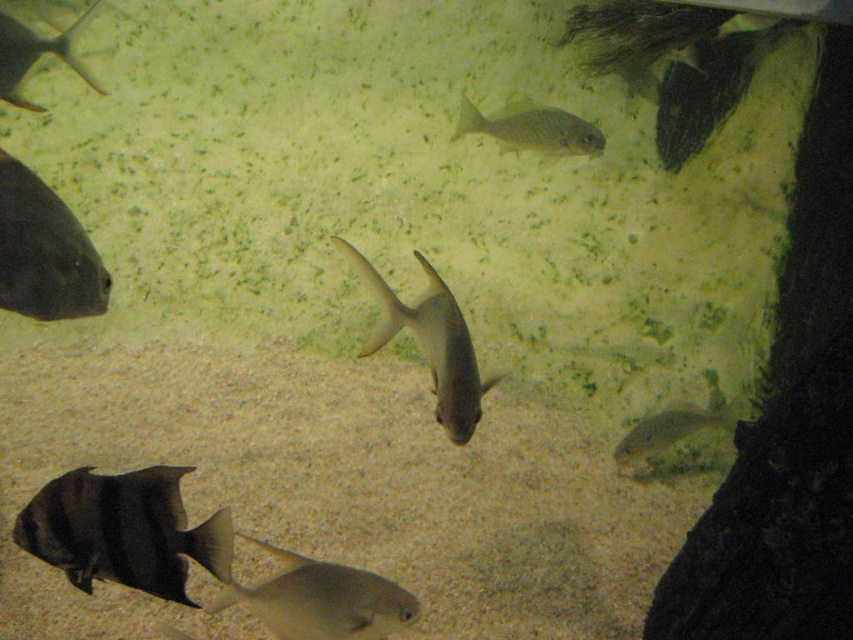
You are a marine biologist observing an underwater scene. You need to locate a specific point in the image for further analysis. Which object is exactly at the coordinates point (321,600)?

The smooth silver fish at bottom center is exactly at the coordinates point (321,600).

You are a diver exploring this underwater scene. You want to reach the matte black fish at left without getting too close. If your safety distance is set to 1.5 meters, can you stay within that limit while observing it?

The distance between you and the matte black fish at left is 1.58 meters, which is slightly beyond your safety distance of 1.5 meters. Therefore, you can maintain the required distance while observing it.

You are a marine biologist observing this underwater scene. You need to locate the shiny silver fish at upper center. What are its coordinates in the image?

The shiny silver fish at upper center is located at coordinates point (532, 129).